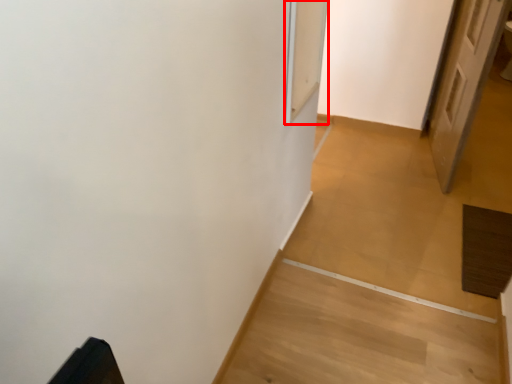
Question: From the image's perspective, what is the correct spatial positioning of screen door (annotated by the red box) in reference to door?

Choices:
 (A) above
 (B) below

Answer: (B)